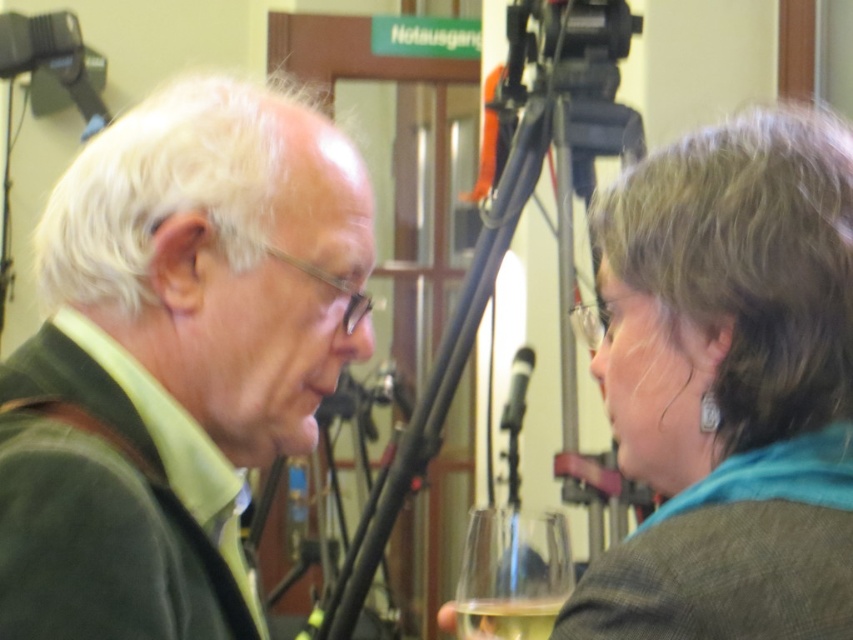
Looking at this image, you are a photographer at a press conference and need to adjust the camera on the black metal tripod at center. To avoid blocking the view of the gray wool scarf at upper right, which direction should you move the camera?

Since the gray wool scarf at upper right is to the right of the black metal tripod at center, moving the camera to the left would avoid blocking its view.

You are a photographer at a press conference. You need to place a small camera accessory next to the clear glass wine glass at lower center without blocking the view of the black metal tripod at center. Given their sizes, is this possible?

The black metal tripod at center is larger in size than the clear glass wine glass at lower center. Since the tripod is larger, placing the accessory next to the wine glass might not block the tripod if positioned carefully, but the size difference means there is enough space around the smaller wine glass to accommodate the accessory without obstructing the tripod.